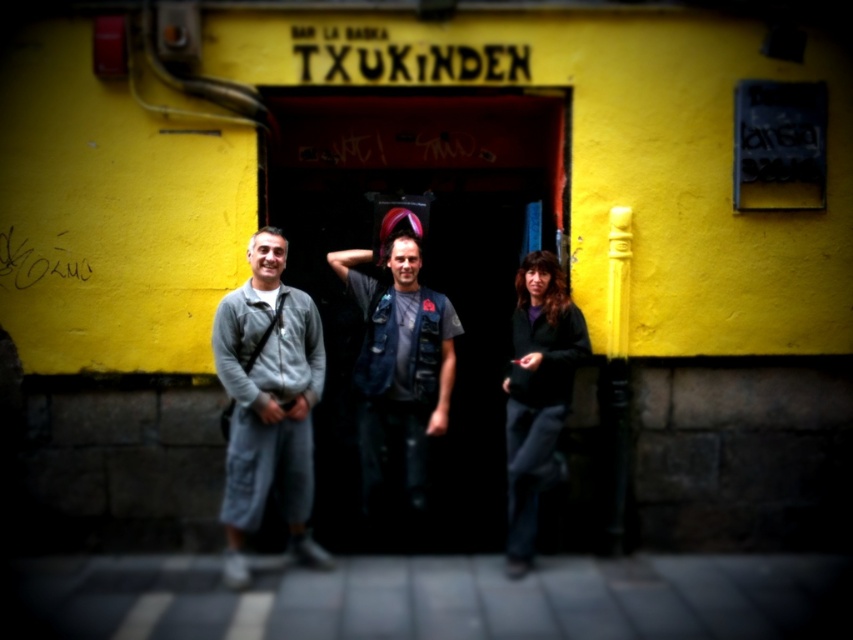
Does denim vest at center come behind dark gray sweater at lower right?

That is True.

Can you confirm if denim vest at center is positioned below dark gray sweater at lower right?

No, denim vest at center is not below dark gray sweater at lower right.

Does point (445, 380) come in front of point (541, 292)?

No, it is not.

Identify the location of denim vest at center. The height and width of the screenshot is (640, 853). (398, 371).

Does point (228, 451) lie behind point (447, 307)?

No, it is in front of (447, 307).

Is gray fabric pants at left taller than denim vest at center?

Indeed, gray fabric pants at left has a greater height compared to denim vest at center.

Does point (254, 458) lie in front of point (380, 492)?

Yes, point (254, 458) is in front of point (380, 492).

Identify the location of gray fabric pants at left. Image resolution: width=853 pixels, height=640 pixels. (268, 403).

How far apart are gray fabric pants at left and dark gray sweater at lower right?

1.39 meters

Is point (303, 406) less distant than point (529, 454)?

That is True.

Where is `gray fabric pants at left`? The height and width of the screenshot is (640, 853). gray fabric pants at left is located at coordinates (268, 403).